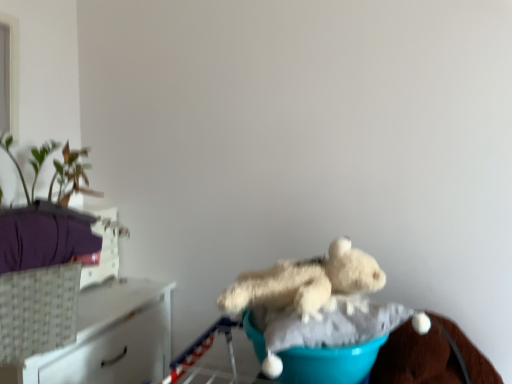
Question: Considering the relative sizes of woven white basket at left and teal fabric at center in the image provided, is woven white basket at left taller than teal fabric at center?

Choices:
 (A) no
 (B) yes

Answer: (B)

Question: Is teal fabric at center inside woven white basket at left?

Choices:
 (A) yes
 (B) no

Answer: (B)

Question: Is woven white basket at left far away from teal fabric at center?

Choices:
 (A) yes
 (B) no

Answer: (B)

Question: From the image's perspective, is woven white basket at left over teal fabric at center?

Choices:
 (A) no
 (B) yes

Answer: (B)

Question: Is woven white basket at left turned away from teal fabric at center?

Choices:
 (A) yes
 (B) no

Answer: (B)

Question: Is woven white basket at left bigger than teal fabric at center?

Choices:
 (A) yes
 (B) no

Answer: (B)

Question: Is there a large distance between woven white basket at left and fluffy white teddy bear at center?

Choices:
 (A) yes
 (B) no

Answer: (B)

Question: Could you tell me if woven white basket at left is facing fluffy white teddy bear at center?

Choices:
 (A) yes
 (B) no

Answer: (B)

Question: Is fluffy white teddy bear at center a part of woven white basket at left?

Choices:
 (A) yes
 (B) no

Answer: (B)

Question: Is woven white basket at left located outside fluffy white teddy bear at center?

Choices:
 (A) no
 (B) yes

Answer: (B)

Question: Can you confirm if woven white basket at left is positioned to the left of fluffy white teddy bear at center?

Choices:
 (A) yes
 (B) no

Answer: (A)

Question: From the image's perspective, is woven white basket at left on fluffy white teddy bear at center?

Choices:
 (A) no
 (B) yes

Answer: (A)

Question: Is white woven basket at left facing towards woven white basket at left?

Choices:
 (A) no
 (B) yes

Answer: (A)